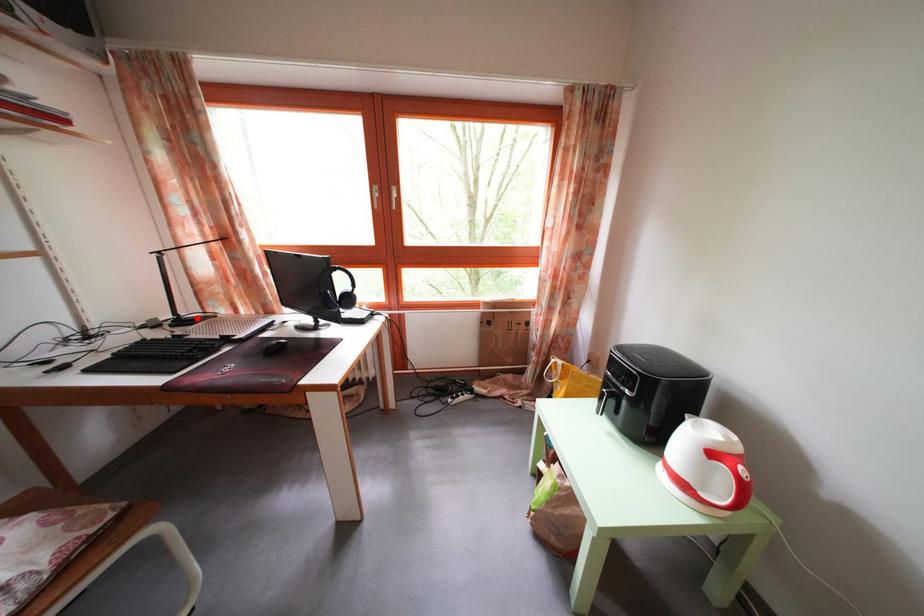
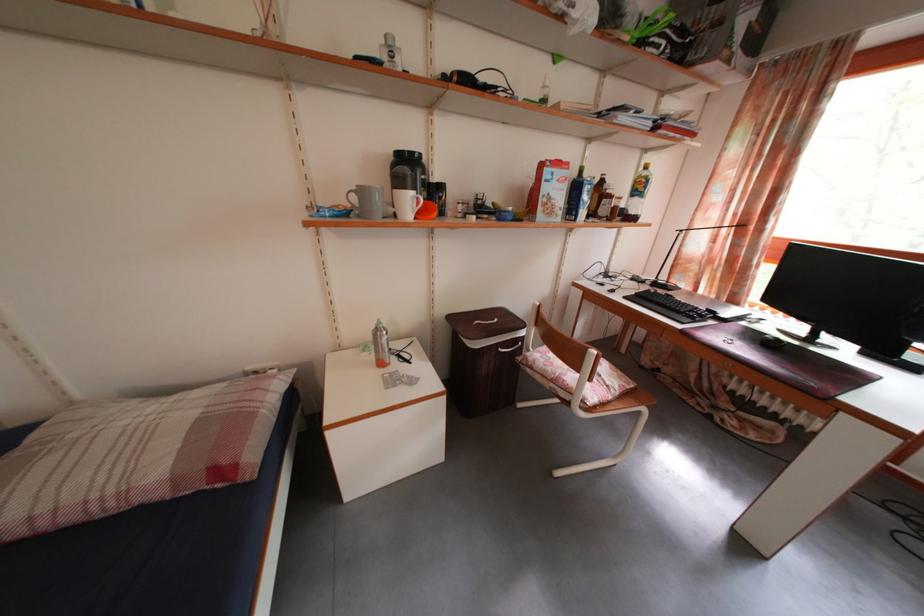
Where in the second image is the point corresponding to the highlighted location from the first image?

(671, 285)